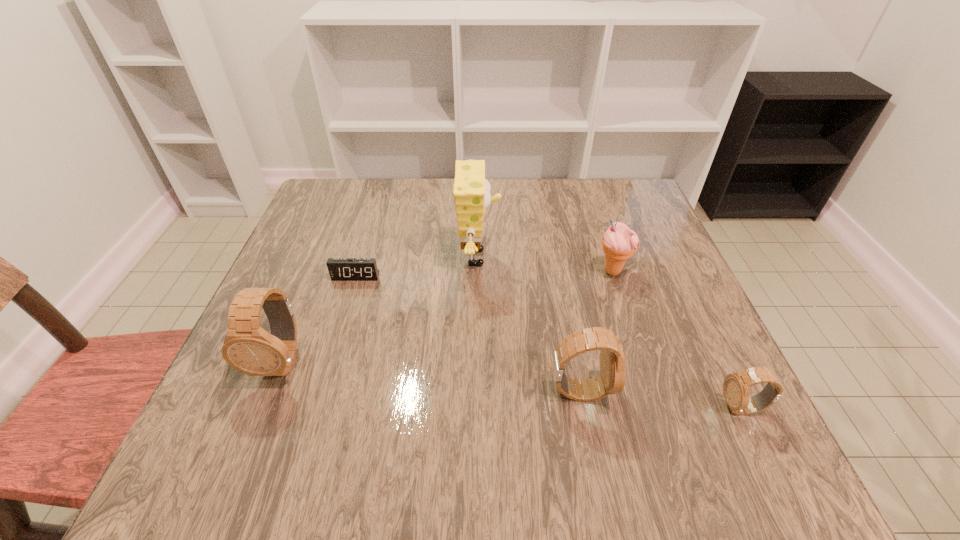
This screenshot has height=540, width=960. I want to click on empty location between the fourth object from left to right and the rightmost object, so (x=660, y=400).

Find the location of `free space that is in between the leftmost watch and the tallest object`. free space that is in between the leftmost watch and the tallest object is located at coordinates (380, 309).

Where is `free space between the third object from right to left and the rightmost object`? The height and width of the screenshot is (540, 960). free space between the third object from right to left and the rightmost object is located at coordinates (660, 400).

I want to click on vacant region between the tallest object and the leftmost watch, so click(x=380, y=309).

This screenshot has width=960, height=540. I want to click on free space between the icecream and the rightmost watch, so click(677, 340).

You are a GUI agent. You are given a task and a screenshot of the screen. Output one action in this format:
    pyautogui.click(x=<x>, y=<y>)
    Task: Click on the vacant area that lies between the second watch from left to right and the leftmost watch
    Image resolution: width=960 pixels, height=540 pixels.
    Given the screenshot: What is the action you would take?
    pyautogui.click(x=431, y=376)

The height and width of the screenshot is (540, 960). In order to click on free space between the second tallest watch and the sponge in this screenshot , I will do `click(529, 325)`.

Locate an element on the screen. The height and width of the screenshot is (540, 960). empty space between the rightmost object and the leftmost watch is located at coordinates (512, 384).

Image resolution: width=960 pixels, height=540 pixels. In order to click on the fourth closest object to the third object from right to left in this screenshot , I will do `click(340, 269)`.

Point out which object is positioned as the second nearest to the rightmost watch. Please provide its 2D coordinates. Your answer should be formatted as a tuple, i.e. [(x, y)], where the tuple contains the x and y coordinates of a point satisfying the conditions above.

[(619, 243)]